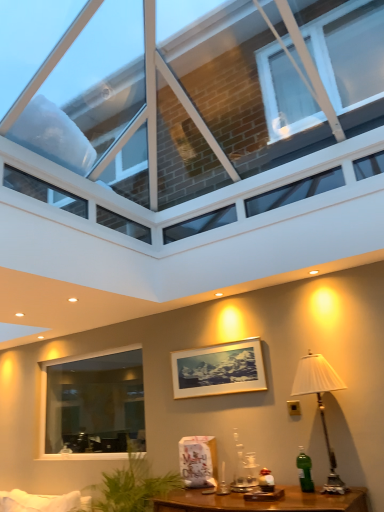
Question: Is green glass bottle at lower right located outside gold-framed picture at center?

Choices:
 (A) yes
 (B) no

Answer: (A)

Question: Considering the relative sizes of green glass bottle at lower right and gold-framed picture at center in the image provided, is green glass bottle at lower right bigger than gold-framed picture at center?

Choices:
 (A) yes
 (B) no

Answer: (B)

Question: Is green glass bottle at lower right to the left of gold-framed picture at center from the viewer's perspective?

Choices:
 (A) yes
 (B) no

Answer: (B)

Question: Would you say green glass bottle at lower right is a long distance from gold-framed picture at center?

Choices:
 (A) no
 (B) yes

Answer: (A)

Question: Can you confirm if green glass bottle at lower right is smaller than gold-framed picture at center?

Choices:
 (A) no
 (B) yes

Answer: (B)

Question: In terms of width, does transparent glass roof at upper center, which is the 2th window in bottom-to-top order, look wider or thinner when compared to clear glass window at lower left, marked as the 1th window in a back-to-front arrangement?

Choices:
 (A) wide
 (B) thin

Answer: (A)

Question: From a real-world perspective, is transparent glass roof at upper center, which is the 2th window in bottom-to-top order, above or below clear glass window at lower left, which ranks as the 1th window in bottom-to-top order?

Choices:
 (A) below
 (B) above

Answer: (B)

Question: Looking at the image, does transparent glass roof at upper center, which is the 2th window in bottom-to-top order, seem bigger or smaller compared to clear glass window at lower left, the 2th window positioned from the top?

Choices:
 (A) small
 (B) big

Answer: (B)

Question: Relative to clear glass window at lower left, positioned as the second window in front-to-back order, is transparent glass roof at upper center, placed as the 2th window when sorted from back to front, in front or behind?

Choices:
 (A) front
 (B) behind

Answer: (A)

Question: Looking at their shapes, would you say clear glass window at lower left, marked as the 1th window in a back-to-front arrangement, is wider or thinner than green glass bottle at lower right?

Choices:
 (A) thin
 (B) wide

Answer: (A)

Question: Based on their sizes in the image, would you say clear glass window at lower left, positioned as the second window in front-to-back order, is bigger or smaller than green glass bottle at lower right?

Choices:
 (A) big
 (B) small

Answer: (A)

Question: From a real-world perspective, is clear glass window at lower left, which ranks as the 1th window in bottom-to-top order, physically located above or below green glass bottle at lower right?

Choices:
 (A) above
 (B) below

Answer: (A)

Question: Considering the positions of clear glass window at lower left, positioned as the second window in front-to-back order, and green glass bottle at lower right in the image, is clear glass window at lower left, positioned as the second window in front-to-back order, taller or shorter than green glass bottle at lower right?

Choices:
 (A) short
 (B) tall

Answer: (B)

Question: From a real-world perspective, relative to gold-framed picture at center, is transparent glass roof at upper center, the 1th window viewed from the top, vertically above or below?

Choices:
 (A) below
 (B) above

Answer: (B)

Question: Is transparent glass roof at upper center, placed as the 2th window when sorted from back to front, in front of or behind gold-framed picture at center in the image?

Choices:
 (A) behind
 (B) front

Answer: (B)